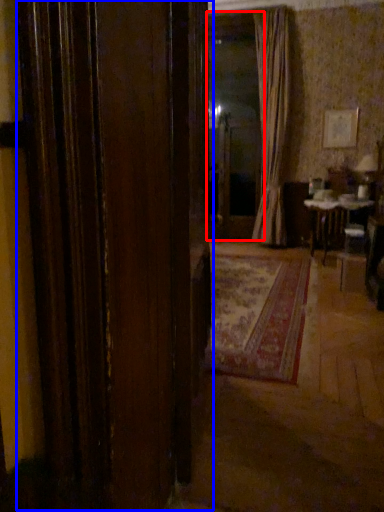
Question: Which of the following is the closest to the observer, window screen (highlighted by a red box) or door (highlighted by a blue box)?

Choices:
 (A) window screen
 (B) door

Answer: (B)